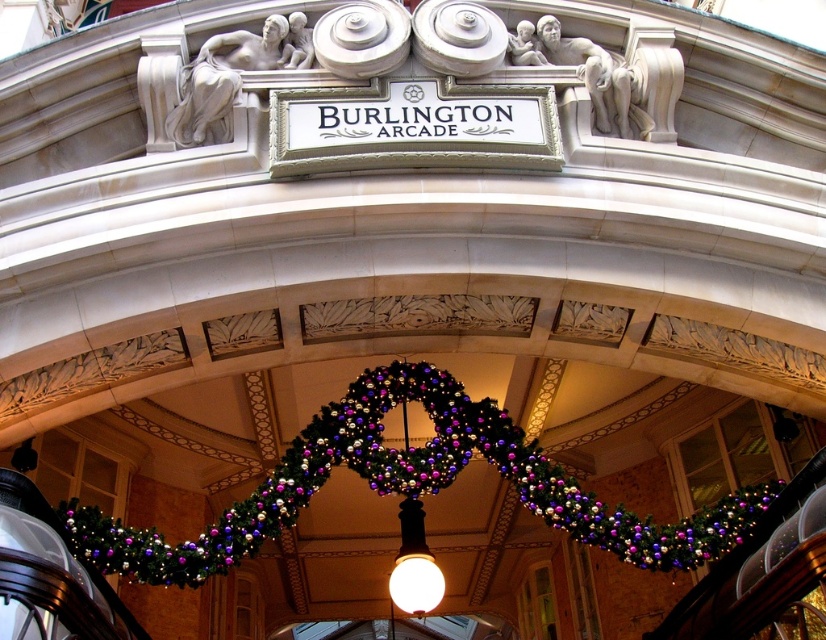
You are a visitor standing at the entrance of Burlington Arcade. You notice the green textured garland at center and the matte white bulb at center. Which object is wider?

The green textured garland at center might be wider than matte white bulb at center according to the description.

You are a visitor standing at the entrance of Burlington Arcade and notice two items hanging from the archway above you. The items are the green textured garland at center and the matte white bulb at center. Which of these two items is larger in size?

The green textured garland at center is bigger than the matte white bulb at center.

You are standing at the entrance of Burlington Arcade and notice two decorations hanging from the archway. The green textured garland at center and the matte white bulb at center. Which one is positioned to the right of the other?

The green textured garland at center is to the right of the matte white bulb at center.